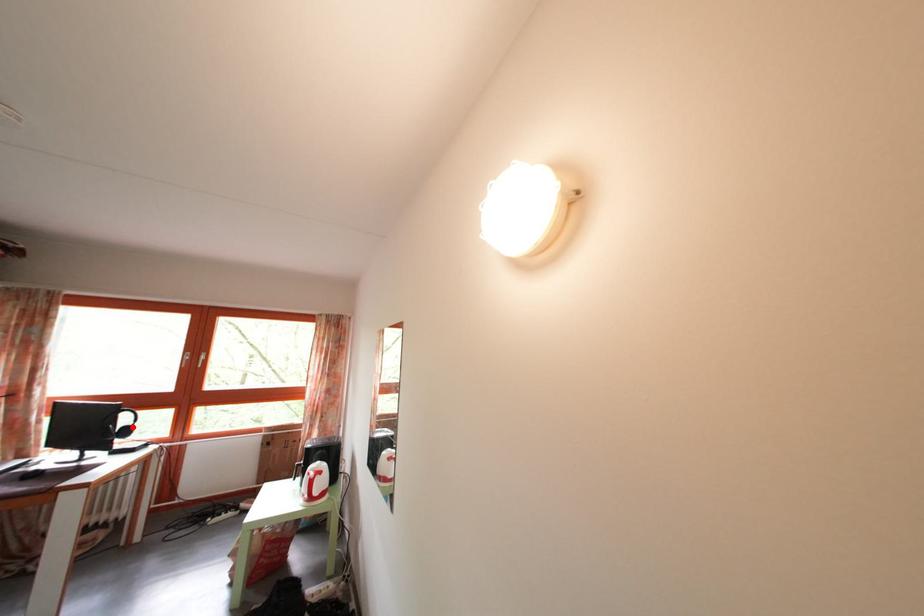
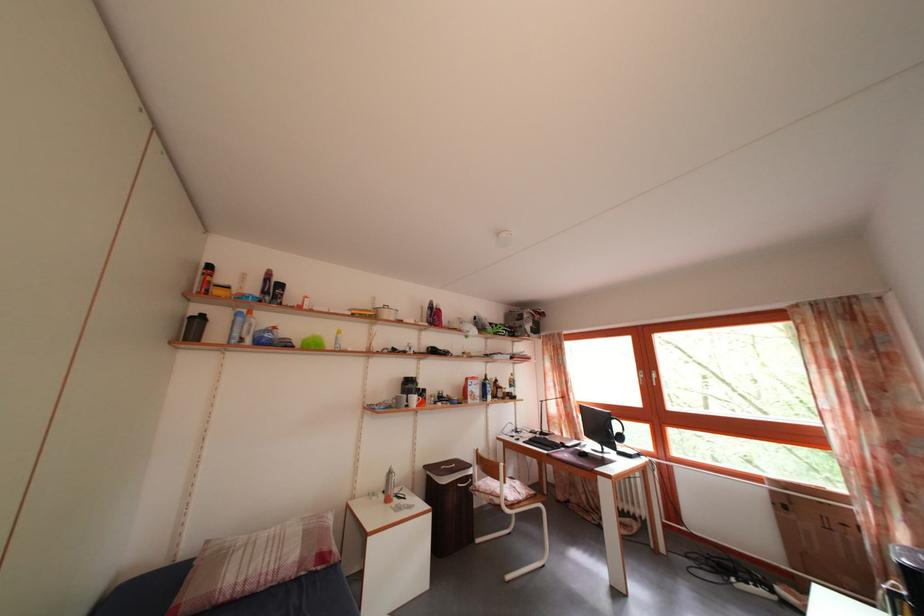
Locate, in the second image, the point that corresponds to the highlighted location in the first image.

(624, 434)